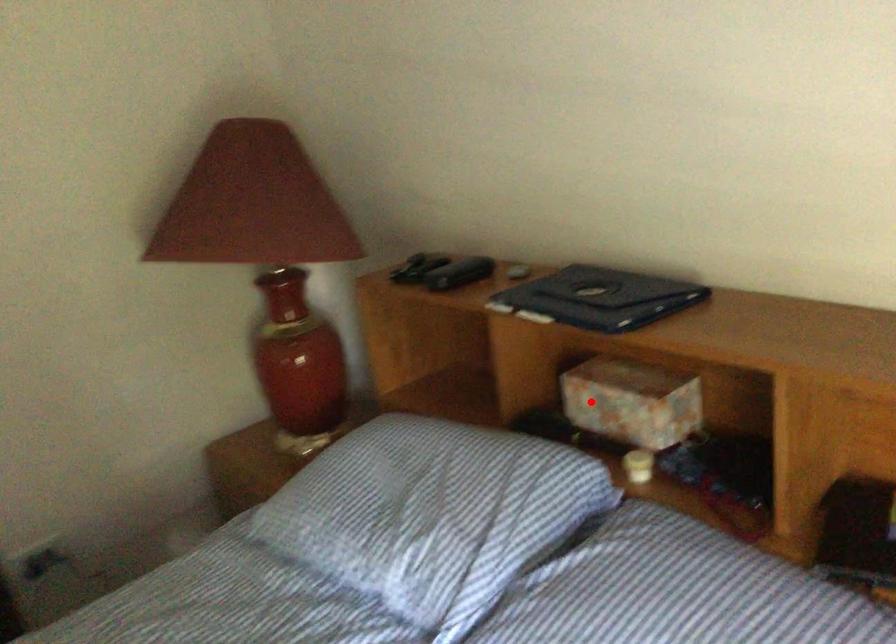
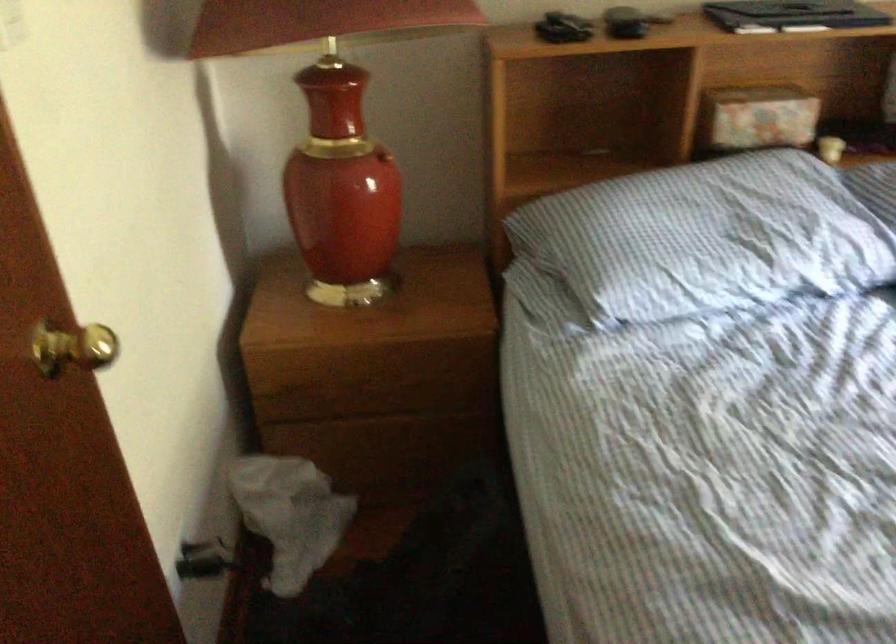
Question: I am providing you with two images of the same scene from different viewpoints. Image1 has a red point marked. In image2, the corresponding 3D location appears at what relative position? Reply with the corresponding letter.

Choices:
 (A) Closer
 (B) Farther

Answer: (B)